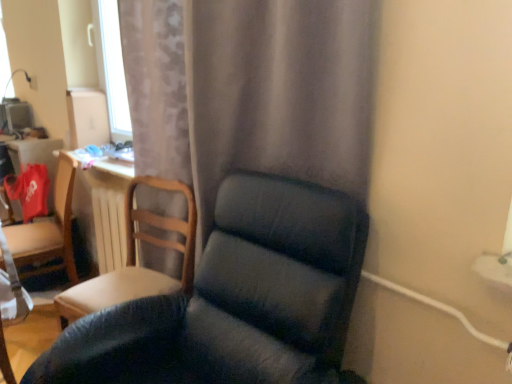
Question: From a real-world perspective, is matte wooden chair at left, positioned as the third chair in right-to-left order, physically above dark blue fabric chair at center, the 3th chair positioned from the left?

Choices:
 (A) no
 (B) yes

Answer: (B)

Question: Is matte wooden chair at left, which appears as the first chair when viewed from the left, at the left side of dark blue fabric chair at center, the 3th chair positioned from the left?

Choices:
 (A) no
 (B) yes

Answer: (B)

Question: Is matte wooden chair at left, marked as the 1th chair in a back-to-front arrangement, facing towards dark blue fabric chair at center, which is the first chair from front to back?

Choices:
 (A) no
 (B) yes

Answer: (A)

Question: Considering the relative sizes of matte wooden chair at left, positioned as the third chair in right-to-left order, and dark blue fabric chair at center, which is counted as the first chair, starting from the right, in the image provided, is matte wooden chair at left, positioned as the third chair in right-to-left order, taller than dark blue fabric chair at center, which is counted as the first chair, starting from the right,?

Choices:
 (A) yes
 (B) no

Answer: (B)

Question: Is matte wooden chair at left, the third chair in the front-to-back sequence, shorter than dark blue fabric chair at center, which is the first chair from front to back?

Choices:
 (A) no
 (B) yes

Answer: (B)

Question: Is matte wooden chair at left, the third chair in the front-to-back sequence, not within dark blue fabric chair at center, which is the third chair in back-to-front order?

Choices:
 (A) no
 (B) yes

Answer: (B)

Question: Considering the relative positions of wooden chair at left, arranged as the second chair when viewed from the front, and dark blue fabric chair at center, which is the third chair in back-to-front order, in the image provided, is wooden chair at left, arranged as the second chair when viewed from the front, to the left of dark blue fabric chair at center, which is the third chair in back-to-front order, from the viewer's perspective?

Choices:
 (A) no
 (B) yes

Answer: (B)

Question: Is wooden chair at left, which is counted as the 2th chair, starting from the right, completely or partially outside of dark blue fabric chair at center, which is the first chair from front to back?

Choices:
 (A) no
 (B) yes

Answer: (B)

Question: Considering the relative positions of wooden chair at left, arranged as the second chair when viewed from the front, and dark blue fabric chair at center, which is counted as the first chair, starting from the right, in the image provided, is wooden chair at left, arranged as the second chair when viewed from the front, behind dark blue fabric chair at center, which is counted as the first chair, starting from the right,?

Choices:
 (A) no
 (B) yes

Answer: (B)

Question: From the image's perspective, is wooden chair at left, which is counted as the 2th chair, starting from the right, on top of dark blue fabric chair at center, the 3th chair positioned from the left?

Choices:
 (A) yes
 (B) no

Answer: (A)

Question: Is wooden chair at left, which is counted as the 2th chair, starting from the right, at the right side of dark blue fabric chair at center, which is the first chair from front to back?

Choices:
 (A) yes
 (B) no

Answer: (B)

Question: Does wooden chair at left, which is the 2th chair from left to right, have a greater height compared to dark blue fabric chair at center, which is counted as the first chair, starting from the right?

Choices:
 (A) yes
 (B) no

Answer: (B)

Question: Can you confirm if white wooden radiator at center is smaller than matte gray curtain at center?

Choices:
 (A) yes
 (B) no

Answer: (A)